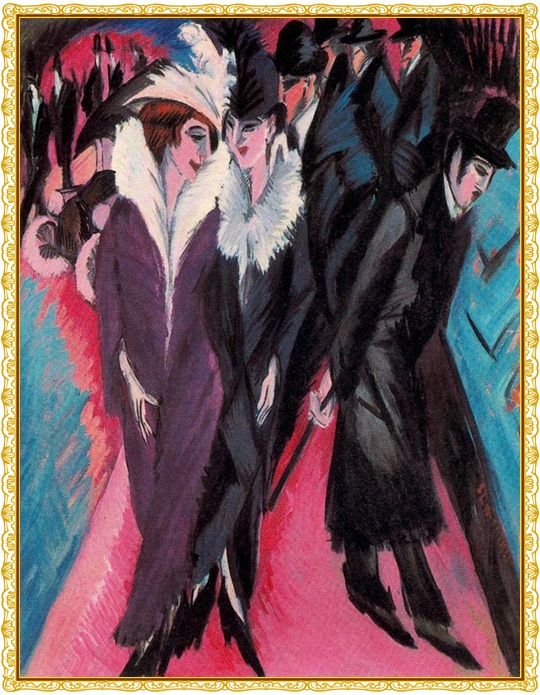
Locate an element on the screen. The width and height of the screenshot is (540, 695). golden picture frame is located at coordinates (271, 8).